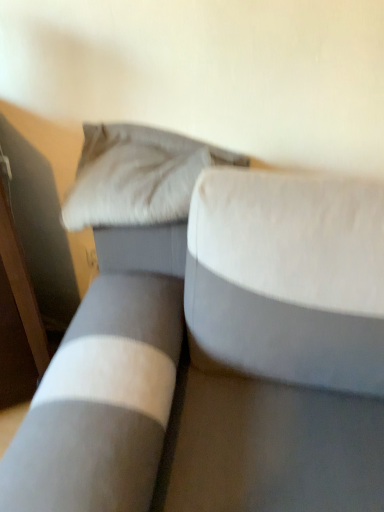
This screenshot has width=384, height=512. Identify the location of gray fabric pillow at upper center. (137, 176).

Measure the distance between point (113,221) and camera.

They are 3.62 feet apart.

This screenshot has width=384, height=512. Describe the element at coordinates (137, 176) in the screenshot. I see `gray fabric pillow at upper center` at that location.

At what (x,y) coordinates should I click in order to perform the action: click on gray fabric pillow at upper center. Please return your answer as a coordinate pair (x, y). Looking at the image, I should click on (137, 176).